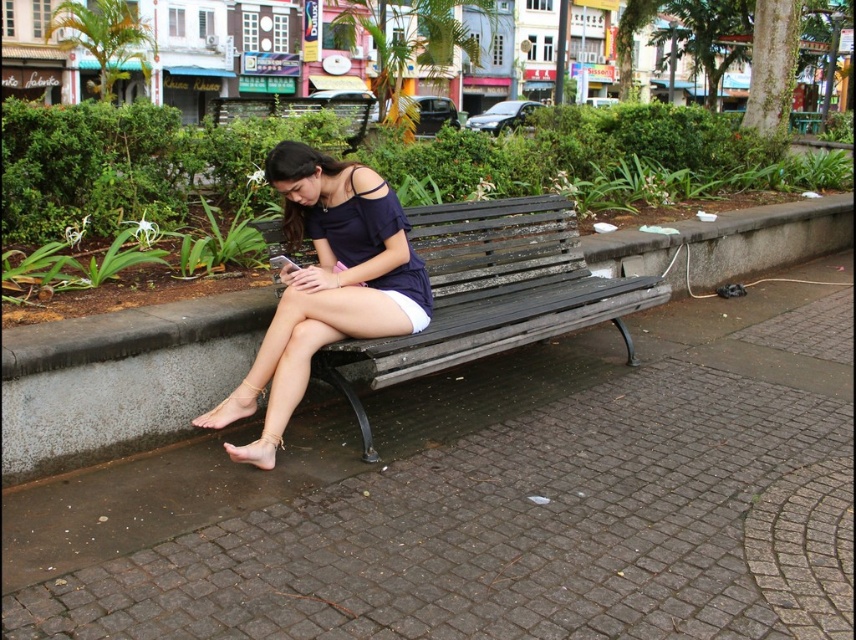
You are a park maintenance worker who needs to move the dark gray wooden bench at center and the matte blue dress at center to store them for winter. The storage area has a maximum width capacity of 1.2 meters. Can both items be stored together without exceeding the width limit?

The dark gray wooden bench at center is wider than the matte blue dress at center. However, since the exact widths are not provided, it is uncertain if their combined width exceeds 1.2 meters. Further measurements are needed to determine storage feasibility.

Based on the photo, you are standing in the park and want to place a small potted plant exactly at the point labeled as point (506, 264). If you walk straight ahead from your current position, will you reach the point before reaching the bench where the woman is sitting?

The point labeled as point (506, 264) is 14.68 feet away from the viewer. Since the bench is part of the scene but its distance isn not specified, we can assume it is farther away than the point. Therefore, you would reach the point before the bench.